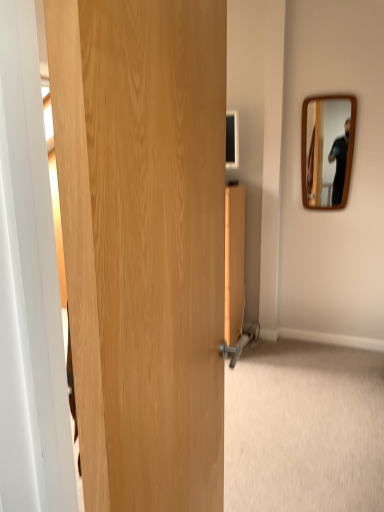
Question: Is natural wood door at center bigger than wooden mirror at upper right?

Choices:
 (A) no
 (B) yes

Answer: (B)

Question: Could wooden mirror at upper right be considered to be inside natural wood door at center?

Choices:
 (A) yes
 (B) no

Answer: (B)

Question: Considering the relative sizes of natural wood door at center and wooden mirror at upper right in the image provided, is natural wood door at center shorter than wooden mirror at upper right?

Choices:
 (A) no
 (B) yes

Answer: (A)

Question: Does natural wood door at center have a lesser width compared to wooden mirror at upper right?

Choices:
 (A) no
 (B) yes

Answer: (A)

Question: From the image's perspective, is natural wood door at center located beneath wooden mirror at upper right?

Choices:
 (A) yes
 (B) no

Answer: (A)

Question: Is natural wood door at center taller than wooden mirror at upper right?

Choices:
 (A) no
 (B) yes

Answer: (B)

Question: Is wooden mirror at upper right at the left side of natural wood door at center?

Choices:
 (A) yes
 (B) no

Answer: (B)

Question: From the image's perspective, is wooden mirror at upper right beneath natural wood door at center?

Choices:
 (A) no
 (B) yes

Answer: (A)

Question: Is wooden mirror at upper right bigger than natural wood door at center?

Choices:
 (A) no
 (B) yes

Answer: (A)

Question: Would you say wooden mirror at upper right is outside natural wood door at center?

Choices:
 (A) no
 (B) yes

Answer: (B)

Question: Is wooden mirror at upper right in contact with natural wood door at center?

Choices:
 (A) yes
 (B) no

Answer: (B)

Question: Is wooden mirror at upper right oriented towards natural wood door at center?

Choices:
 (A) no
 (B) yes

Answer: (B)

Question: From the image's perspective, is natural wood door at center located above or below wooden mirror at upper right?

Choices:
 (A) above
 (B) below

Answer: (B)